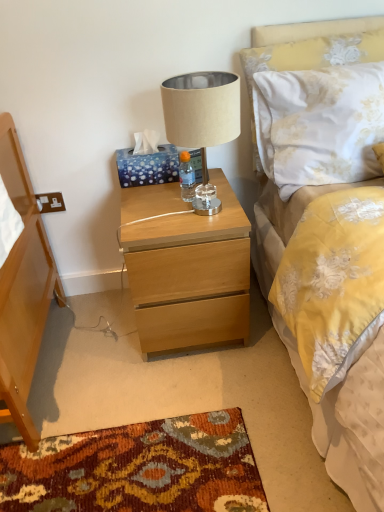
Question: Is clear plastic bottle at center turned away from beige fabric lampshade at center?

Choices:
 (A) yes
 (B) no

Answer: (A)

Question: From a real-world perspective, is clear plastic bottle at center located beneath beige fabric lampshade at center?

Choices:
 (A) yes
 (B) no

Answer: (A)

Question: From the image's perspective, is clear plastic bottle at center above beige fabric lampshade at center?

Choices:
 (A) no
 (B) yes

Answer: (A)

Question: Can you confirm if clear plastic bottle at center is shorter than beige fabric lampshade at center?

Choices:
 (A) yes
 (B) no

Answer: (A)

Question: Is clear plastic bottle at center in contact with beige fabric lampshade at center?

Choices:
 (A) no
 (B) yes

Answer: (A)

Question: Based on their positions, is beige fabric lampshade at center located to the left or right of light wood nightstand at center?

Choices:
 (A) left
 (B) right

Answer: (B)

Question: Considering the positions of beige fabric lampshade at center and light wood nightstand at center in the image, is beige fabric lampshade at center wider or thinner than light wood nightstand at center?

Choices:
 (A) thin
 (B) wide

Answer: (A)

Question: Do you think beige fabric lampshade at center is within light wood nightstand at center, or outside of it?

Choices:
 (A) inside
 (B) outside

Answer: (B)

Question: Is point (168, 108) positioned closer to the camera than point (182, 247)?

Choices:
 (A) closer
 (B) farther

Answer: (A)

Question: In the image, is light wood nightstand at center positioned in front of or behind beige fabric lampshade at center?

Choices:
 (A) front
 (B) behind

Answer: (B)

Question: Considering the positions of light wood nightstand at center and beige fabric lampshade at center in the image, is light wood nightstand at center wider or thinner than beige fabric lampshade at center?

Choices:
 (A) thin
 (B) wide

Answer: (B)

Question: Considering the relative positions of light wood nightstand at center and beige fabric lampshade at center in the image provided, is light wood nightstand at center to the left or to the right of beige fabric lampshade at center?

Choices:
 (A) right
 (B) left

Answer: (B)

Question: From the image's perspective, is light wood nightstand at center located above or below beige fabric lampshade at center?

Choices:
 (A) above
 (B) below

Answer: (B)

Question: Is white floral fabric pillow at upper right in front of or behind light wood nightstand at center in the image?

Choices:
 (A) front
 (B) behind

Answer: (B)

Question: Is white floral fabric pillow at upper right to the left or to the right of light wood nightstand at center in the image?

Choices:
 (A) left
 (B) right

Answer: (B)